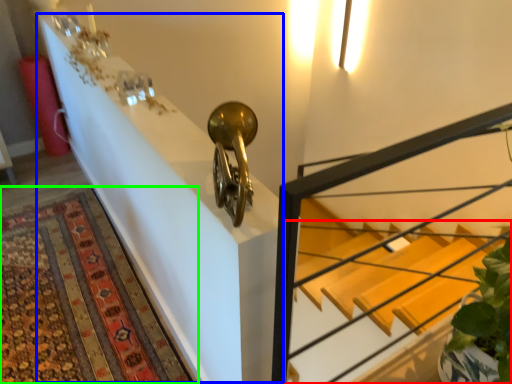
Question: Considering the real-world distances, which object is farthest from stairs (highlighted by a red box)? table (highlighted by a blue box) or mat (highlighted by a green box)?

Choices:
 (A) table
 (B) mat

Answer: (A)